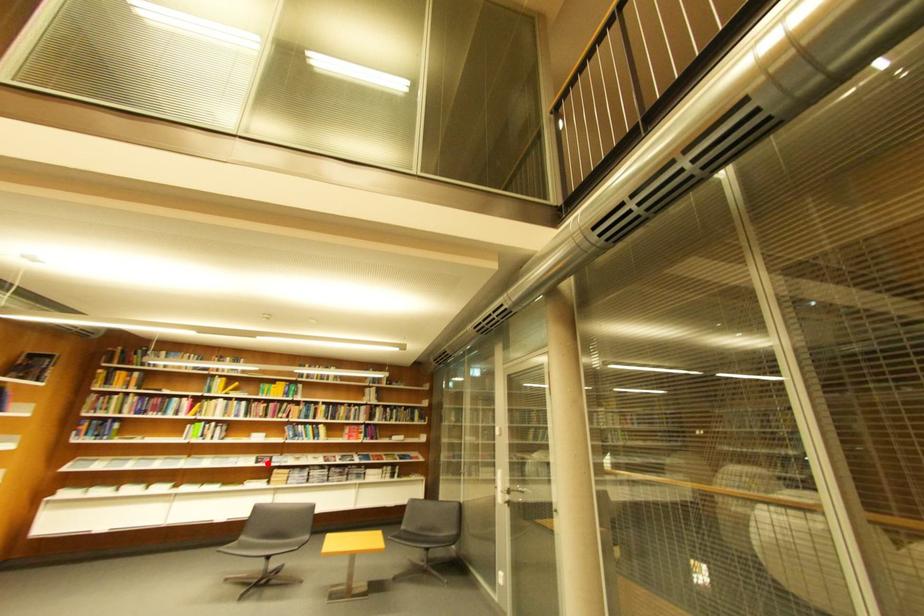
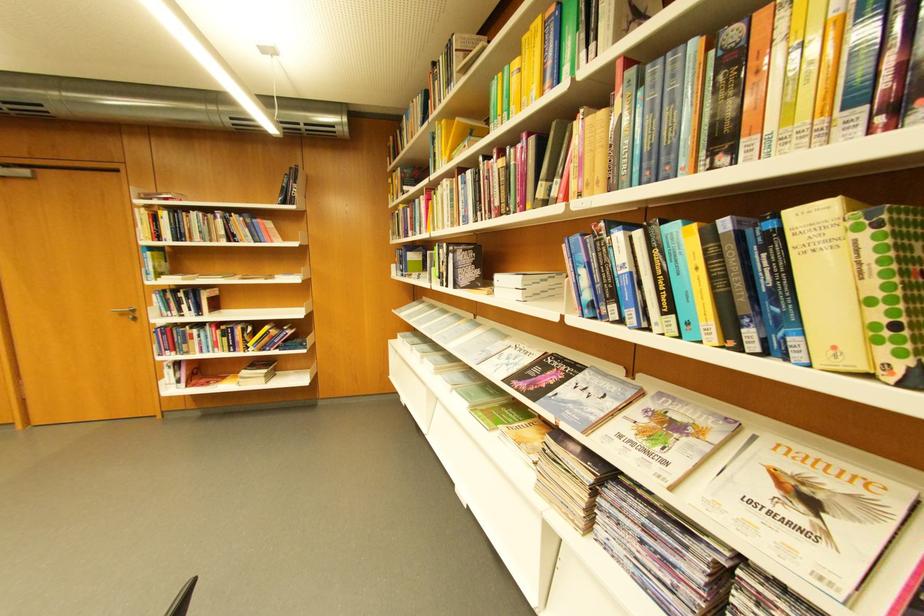
Find the pixel in the second image that matches the highlighted location in the first image.

(532, 377)